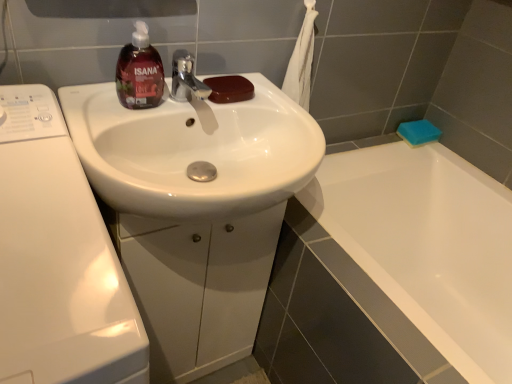
Question: Can you confirm if translucent dark red liquid soap at upper left is wider than brown glossy soap at center, placed as the first soap when sorted from left to right?

Choices:
 (A) yes
 (B) no

Answer: (B)

Question: Can you see translucent dark red liquid soap at upper left touching brown glossy soap at center, placed as the first soap when sorted from left to right?

Choices:
 (A) yes
 (B) no

Answer: (B)

Question: Does translucent dark red liquid soap at upper left turn towards brown glossy soap at center, which is the 2th soap in right-to-left order?

Choices:
 (A) yes
 (B) no

Answer: (B)

Question: Is brown glossy soap at center, the second soap from the back, completely or partially inside translucent dark red liquid soap at upper left?

Choices:
 (A) no
 (B) yes

Answer: (A)

Question: Is translucent dark red liquid soap at upper left to the right of brown glossy soap at center, the second soap from the back, from the viewer's perspective?

Choices:
 (A) no
 (B) yes

Answer: (A)

Question: From the image's perspective, would you say translucent dark red liquid soap at upper left is shown under brown glossy soap at center, which is the 1th soap in front-to-back order?

Choices:
 (A) yes
 (B) no

Answer: (B)

Question: Considering the relative positions of white glossy washing machine at left and white glossy cabinet at center in the image provided, is white glossy washing machine at left behind white glossy cabinet at center?

Choices:
 (A) yes
 (B) no

Answer: (B)

Question: Considering the relative sizes of white glossy washing machine at left and white glossy cabinet at center in the image provided, is white glossy washing machine at left wider than white glossy cabinet at center?

Choices:
 (A) no
 (B) yes

Answer: (B)

Question: Is white glossy cabinet at center located within white glossy washing machine at left?

Choices:
 (A) yes
 (B) no

Answer: (B)

Question: Is white glossy washing machine at left to the right of white glossy cabinet at center from the viewer's perspective?

Choices:
 (A) no
 (B) yes

Answer: (A)

Question: Does white glossy washing machine at left have a lesser height compared to white glossy cabinet at center?

Choices:
 (A) no
 (B) yes

Answer: (A)

Question: Does white glossy washing machine at left have a smaller size compared to white glossy cabinet at center?

Choices:
 (A) yes
 (B) no

Answer: (B)

Question: Can you confirm if brown glossy soap at center, which is the 2th soap in right-to-left order, is thinner than white glossy cabinet at center?

Choices:
 (A) yes
 (B) no

Answer: (A)